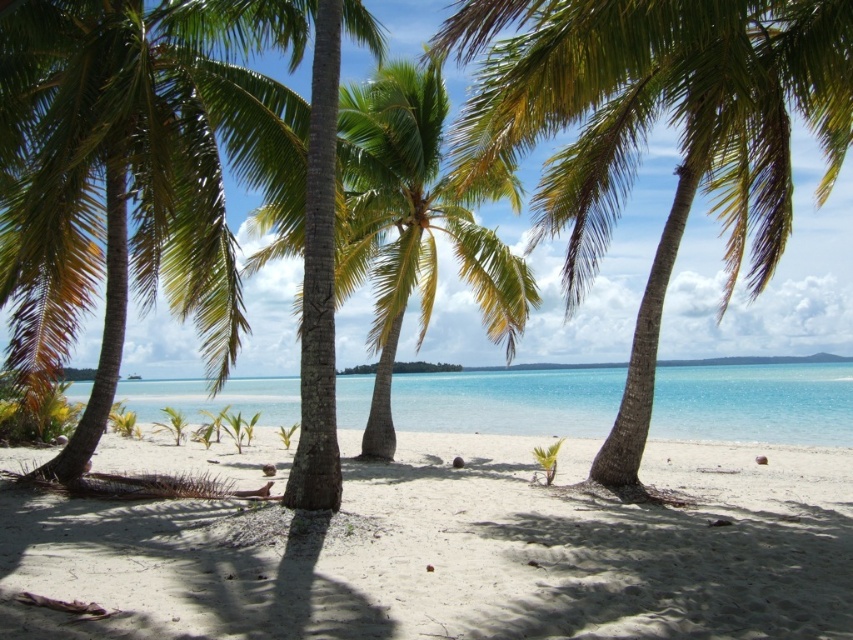
Which is more to the left, green leafy palm tree at left or clear blue water at center?

green leafy palm tree at left is more to the left.

Which is behind, point (42, 154) or point (610, 374)?

Positioned behind is point (610, 374).

Image resolution: width=853 pixels, height=640 pixels. I want to click on green leafy palm tree at left, so click(x=125, y=180).

Describe the element at coordinates (462, 554) in the screenshot. The height and width of the screenshot is (640, 853). I see `white sandy beach at center` at that location.

Between white sandy beach at center and green leafy palm tree at left, which one is positioned higher?

green leafy palm tree at left is above.

At what (x,y) coordinates should I click in order to perform the action: click on white sandy beach at center. Please return your answer as a coordinate pair (x, y). The height and width of the screenshot is (640, 853). Looking at the image, I should click on (462, 554).

Find the location of a particular element. This screenshot has height=640, width=853. white sandy beach at center is located at coordinates (462, 554).

What do you see at coordinates (646, 131) in the screenshot? This screenshot has width=853, height=640. I see `green leafy palm tree at center` at bounding box center [646, 131].

Is point (701, 124) behind point (207, 321)?

No.

Locate an element on the screen. The image size is (853, 640). green leafy palm tree at center is located at coordinates (646, 131).